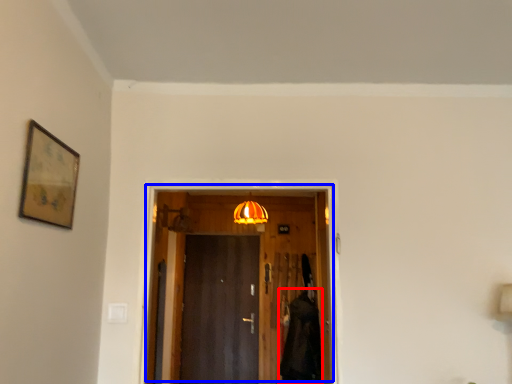
Question: Among these objects, which one is nearest to the camera, robe (highlighted by a red box) or door (highlighted by a blue box)?

Choices:
 (A) robe
 (B) door

Answer: (B)